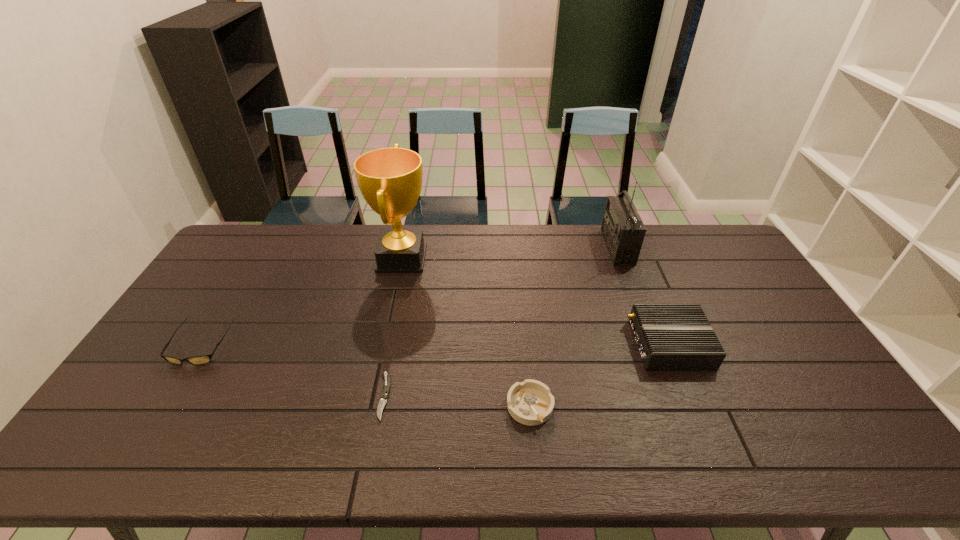
At what (x,y) coordinates should I click in order to perform the action: click on free space between the third shortest object and the router. Please return your answer as a coordinate pair (x, y). This screenshot has height=540, width=960. Looking at the image, I should click on (435, 345).

This screenshot has height=540, width=960. I want to click on unoccupied position between the sunglasses and the shortest object, so click(x=292, y=370).

Image resolution: width=960 pixels, height=540 pixels. In order to click on free space between the second shortest object and the fourth shortest object in this screenshot , I will do `click(600, 375)`.

Where is `free space between the award and the shortest object`? Image resolution: width=960 pixels, height=540 pixels. free space between the award and the shortest object is located at coordinates (393, 327).

This screenshot has width=960, height=540. Find the location of `vacant space that's between the third tallest object and the pocketknife`. vacant space that's between the third tallest object and the pocketknife is located at coordinates point(526,370).

Identify the location of free point between the sunglasses and the ashtray. Image resolution: width=960 pixels, height=540 pixels. (366, 376).

Locate an element on the screen. The width and height of the screenshot is (960, 540). free spot between the fifth tallest object and the fourth shortest object is located at coordinates (600, 375).

The width and height of the screenshot is (960, 540). What are the coordinates of `object that is the fifth closest to the fourth object from left to right` in the screenshot? It's located at (199, 359).

This screenshot has height=540, width=960. I want to click on the fifth closest object to the award, so click(623, 230).

Where is `blank area in the image that satisfies the following two spatial constraints: 1. on the back panel of the router; 2. on the front side of the pocketknife`? blank area in the image that satisfies the following two spatial constraints: 1. on the back panel of the router; 2. on the front side of the pocketknife is located at coordinates (691, 396).